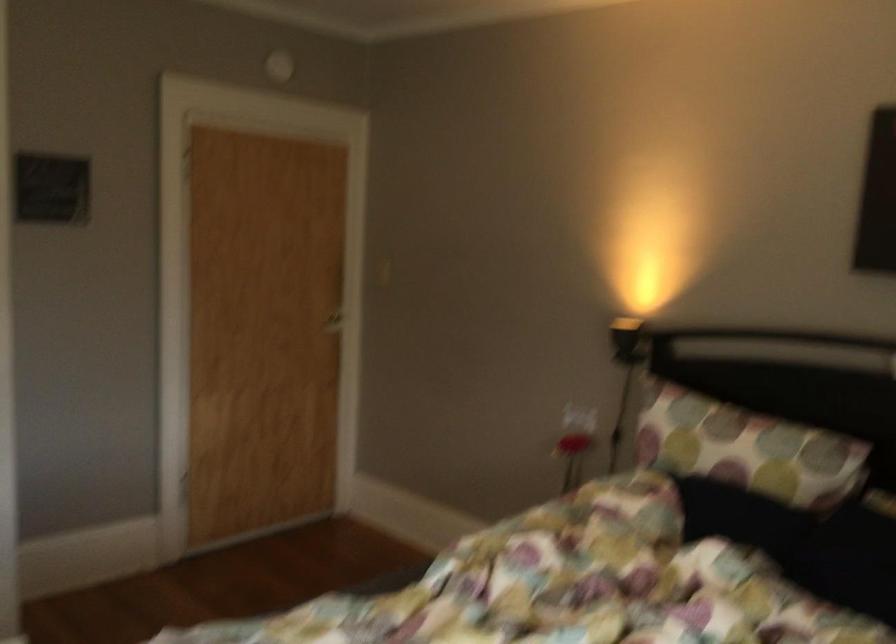
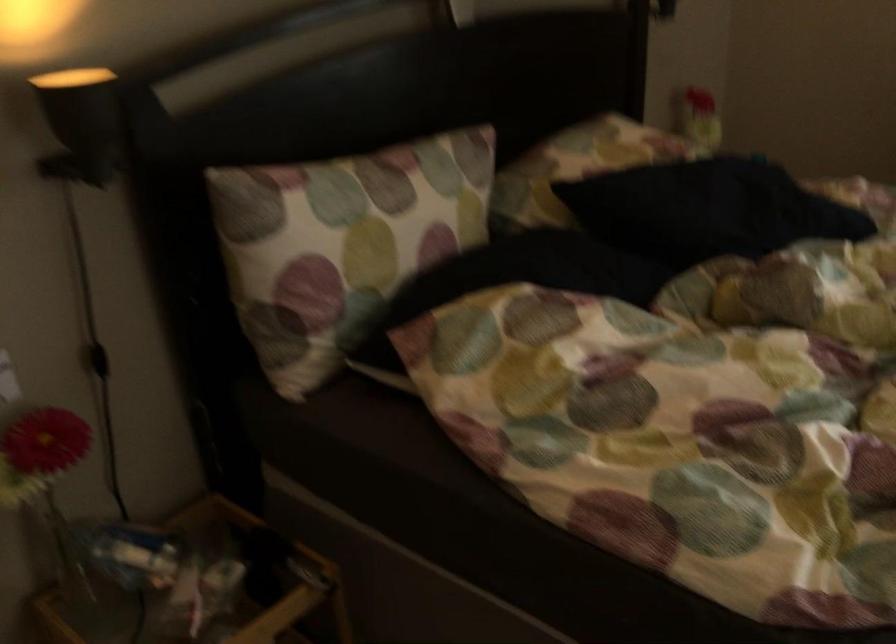
In the second image, find the point that corresponds to point 564,451 in the first image.

(46, 480)